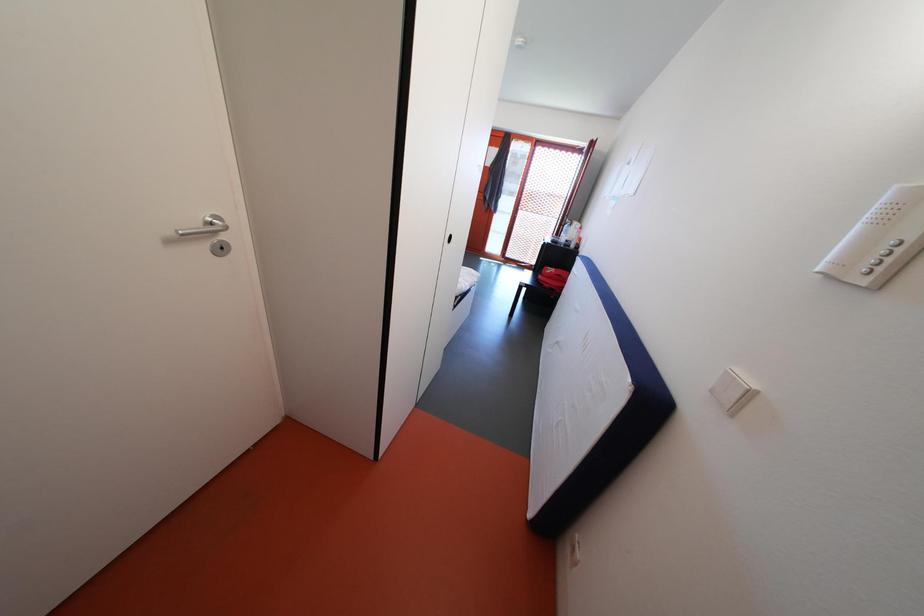
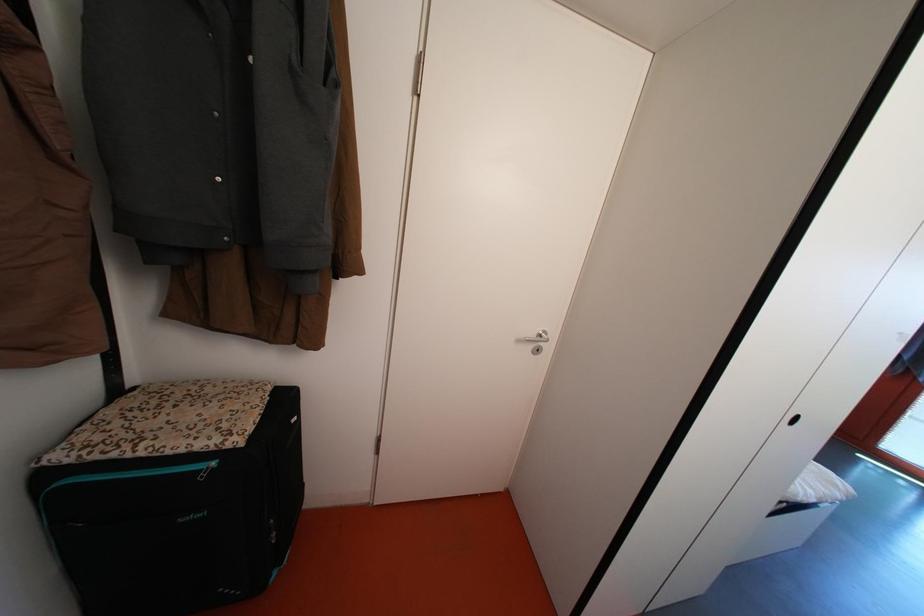
Question: The camera is either moving clockwise (left) or counter-clockwise (right) around the object. The first image is from the beginning of the video and the second image is from the end. Is the camera moving left or right when shooting the video?

Choices:
 (A) Left
 (B) Right

Answer: (B)